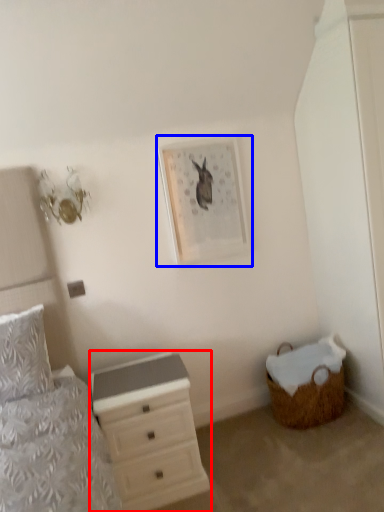
Question: Which of the following is the closest to the observer, chest of drawers (highlighted by a red box) or picture frame (highlighted by a blue box)?

Choices:
 (A) chest of drawers
 (B) picture frame

Answer: (A)